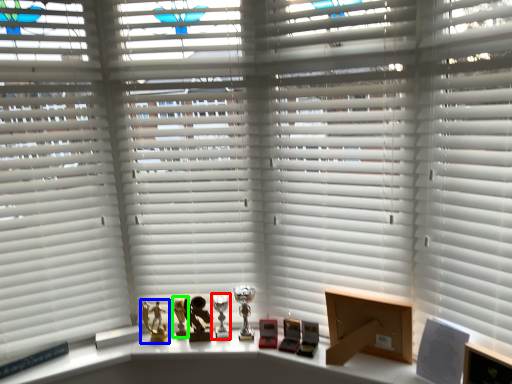
Question: Which object is the closest to the table lamp (highlighted by a red box)? Choose among these: toy (highlighted by a blue box) or miniature (highlighted by a green box).

Choices:
 (A) toy
 (B) miniature

Answer: (B)